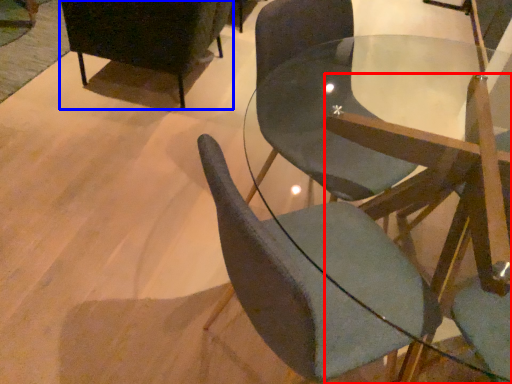
Question: Among these objects, which one is farthest to the camera, chair (highlighted by a red box) or chair (highlighted by a blue box)?

Choices:
 (A) chair
 (B) chair

Answer: (B)